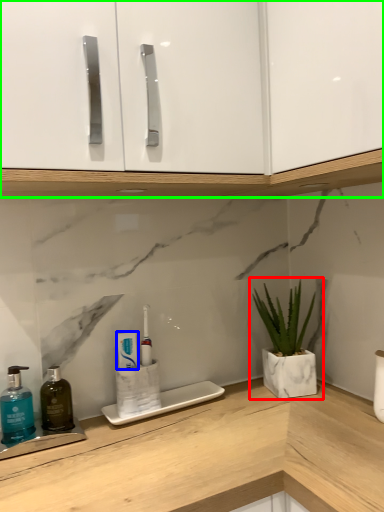
Question: Considering the real-world distances, which object is closest to houseplant (highlighted by a red box)? toothpaste (highlighted by a blue box) or cabinetry (highlighted by a green box).

Choices:
 (A) toothpaste
 (B) cabinetry

Answer: (A)